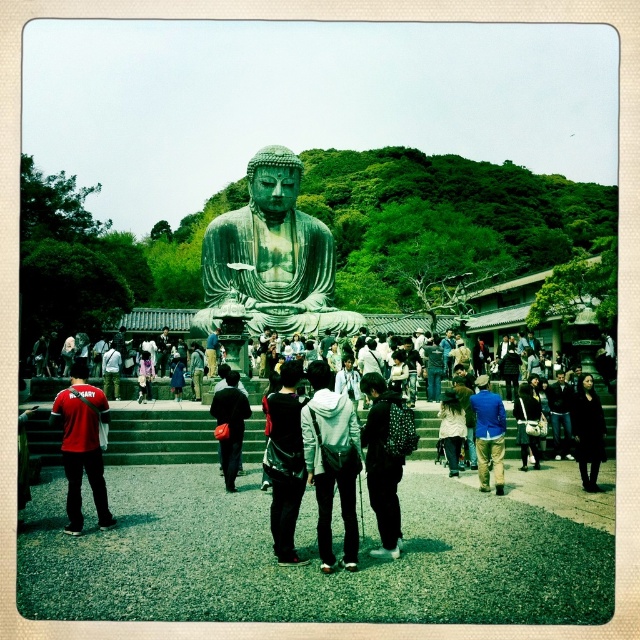
Question: Which object is positioned closest to the red cotton shirt at left?

Choices:
 (A) dark gray fabric backpack at center
 (B) black leather jacket at lower right
 (C) black fabric jacket at center
 (D) white hoodie at center

Answer: (A)

Question: Among these objects, which one is farthest from the camera?

Choices:
 (A) white hoodie at center
 (B) black fabric jacket at center
 (C) black leather jacket at lower right

Answer: (C)

Question: Which point appears closest to the camera in this image?

Choices:
 (A) (56, 416)
 (B) (534, 403)
 (C) (593, 467)
 (D) (497, 404)

Answer: (A)

Question: Does white hoodie at center have a larger size compared to black leather jacket at lower right?

Choices:
 (A) yes
 (B) no

Answer: (B)

Question: Does green patina statue at center come behind dark gray fabric backpack at center?

Choices:
 (A) yes
 (B) no

Answer: (A)

Question: Does blue cotton shirt at center appear over black leather jacket at lower right?

Choices:
 (A) no
 (B) yes

Answer: (B)